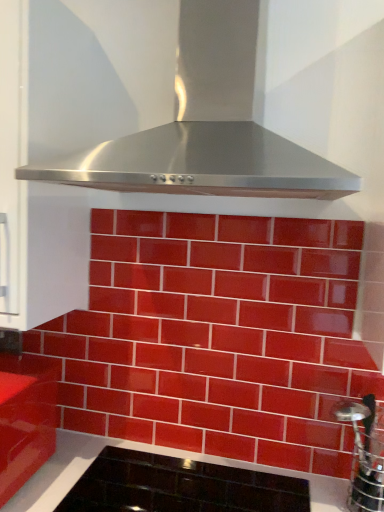
Question: Is stainless steel at right taller than stainless steel range hood at upper center?

Choices:
 (A) no
 (B) yes

Answer: (A)

Question: Is stainless steel at right facing away from stainless steel range hood at upper center?

Choices:
 (A) no
 (B) yes

Answer: (A)

Question: Could you tell me if stainless steel at right is turned towards stainless steel range hood at upper center?

Choices:
 (A) yes
 (B) no

Answer: (B)

Question: From the image's perspective, is stainless steel at right above stainless steel range hood at upper center?

Choices:
 (A) yes
 (B) no

Answer: (B)

Question: Is stainless steel at right far away from stainless steel range hood at upper center?

Choices:
 (A) yes
 (B) no

Answer: (B)

Question: From a real-world perspective, is stainless steel at right above or below stainless steel range hood at upper center?

Choices:
 (A) below
 (B) above

Answer: (A)

Question: Considering the positions of stainless steel at right and stainless steel range hood at upper center in the image, is stainless steel at right wider or thinner than stainless steel range hood at upper center?

Choices:
 (A) wide
 (B) thin

Answer: (B)

Question: Is stainless steel at right in front of or behind stainless steel range hood at upper center in the image?

Choices:
 (A) behind
 (B) front

Answer: (A)

Question: In terms of height, does stainless steel at right look taller or shorter compared to stainless steel range hood at upper center?

Choices:
 (A) short
 (B) tall

Answer: (A)

Question: Is point (362, 460) positioned closer to the camera than point (41, 369)?

Choices:
 (A) farther
 (B) closer

Answer: (B)

Question: From a real-world perspective, is stainless steel at right positioned above or below glossy red cabinet at lower left?

Choices:
 (A) below
 (B) above

Answer: (B)

Question: Considering their positions, is stainless steel at right located in front of or behind glossy red cabinet at lower left?

Choices:
 (A) front
 (B) behind

Answer: (A)

Question: In terms of size, does stainless steel at right appear bigger or smaller than glossy red cabinet at lower left?

Choices:
 (A) small
 (B) big

Answer: (A)

Question: Relative to stainless steel range hood at upper center, is black glass cooktop at lower center in front or behind?

Choices:
 (A) front
 (B) behind

Answer: (B)

Question: Is black glass cooktop at lower center bigger or smaller than stainless steel range hood at upper center?

Choices:
 (A) big
 (B) small

Answer: (B)